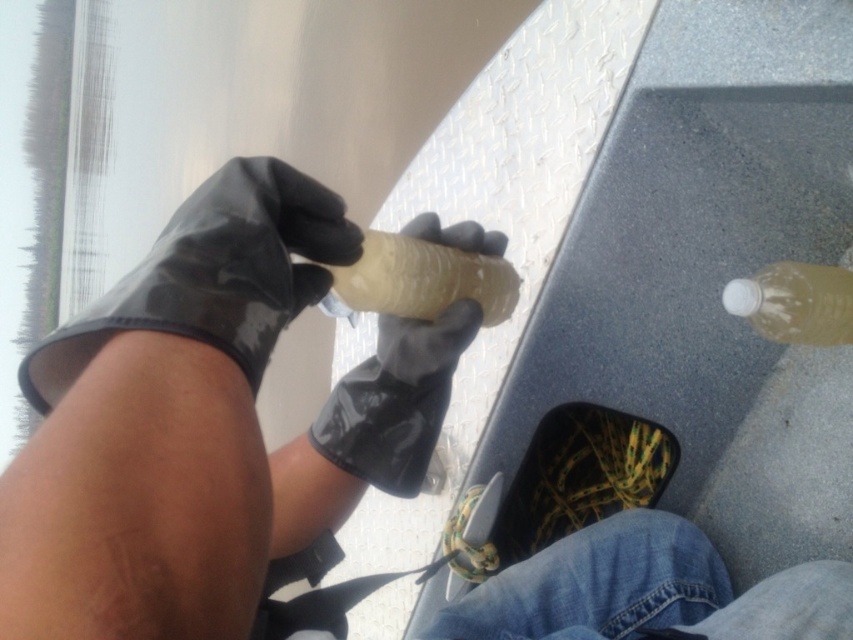
Is black rubber glove at upper left wider than black rubber glove at center?

Yes, black rubber glove at upper left is wider than black rubber glove at center.

Is black rubber glove at upper left to the right of black rubber glove at center from the viewer's perspective?

No, black rubber glove at upper left is not to the right of black rubber glove at center.

Locate an element on the screen. Image resolution: width=853 pixels, height=640 pixels. black rubber glove at upper left is located at coordinates (213, 275).

The image size is (853, 640). I want to click on black rubber glove at upper left, so click(213, 275).

Can you confirm if translucent plastic bottle at center is positioned above translucent rubber glove at center?

Incorrect, translucent plastic bottle at center is not positioned above translucent rubber glove at center.

Which of these two, translucent plastic bottle at center or translucent rubber glove at center, stands taller?

translucent rubber glove at center

Does point (367, 234) come farther from viewer compared to point (399, 353)?

No.

At what (x,y) coordinates should I click in order to perform the action: click on translucent plastic bottle at center. Please return your answer as a coordinate pair (x, y). The height and width of the screenshot is (640, 853). Looking at the image, I should click on (419, 280).

Image resolution: width=853 pixels, height=640 pixels. Find the location of `black rubber glove at upper left`. black rubber glove at upper left is located at coordinates (213, 275).

Can you confirm if black rubber glove at upper left is taller than translucent plastic bottle at lower right?

Indeed, black rubber glove at upper left has a greater height compared to translucent plastic bottle at lower right.

Find the location of a particular element. black rubber glove at upper left is located at coordinates (213, 275).